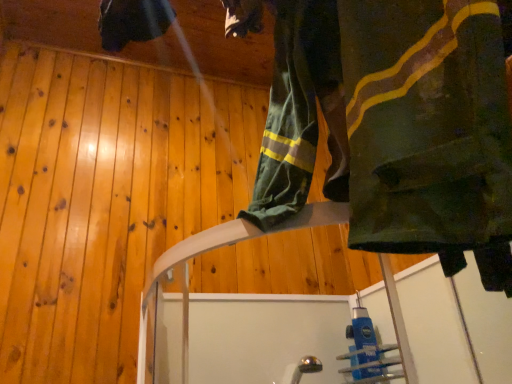
What do you see at coordinates (429, 132) in the screenshot? I see `camouflage fabric pants at center` at bounding box center [429, 132].

Image resolution: width=512 pixels, height=384 pixels. Identify the location of camouflage fabric pants at center. (429, 132).

Image resolution: width=512 pixels, height=384 pixels. In order to click on camouflage fabric pants at center in this screenshot , I will do 429,132.